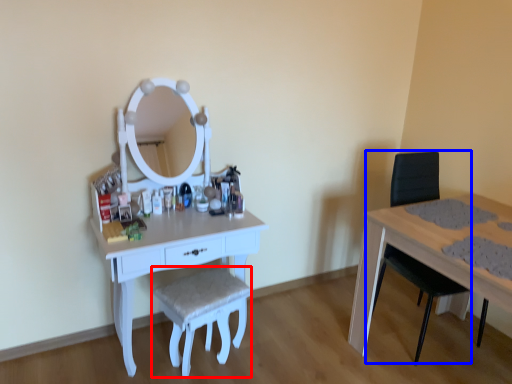
Question: Which of the following is the farthest to the observer, stool (highlighted by a red box) or swivel chair (highlighted by a blue box)?

Choices:
 (A) stool
 (B) swivel chair

Answer: (B)